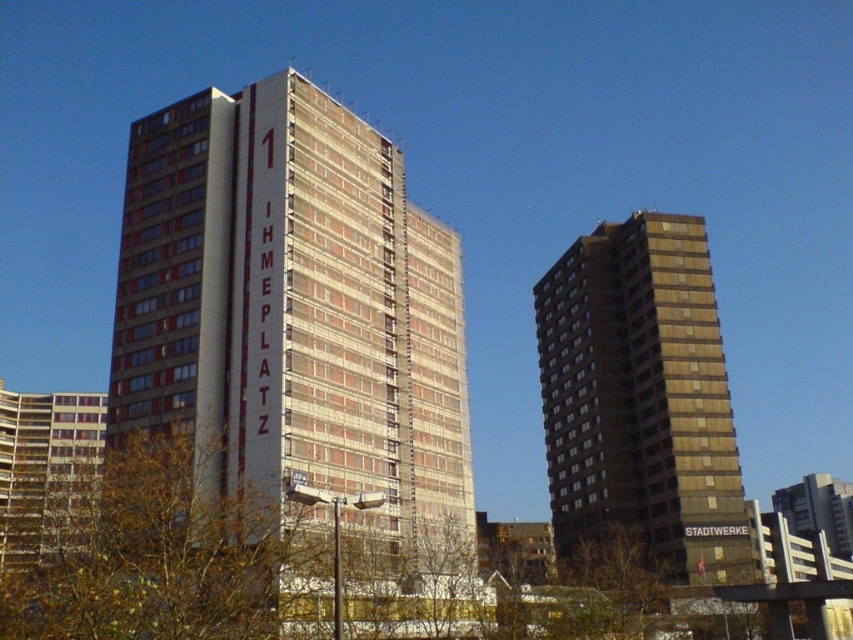
Does brick textured building at center have a larger size compared to brown matte building at right?

Indeed, brick textured building at center has a larger size compared to brown matte building at right.

Can you confirm if brick textured building at center is positioned to the left of brown matte building at right?

Correct, you'll find brick textured building at center to the left of brown matte building at right.

Between point (461, 326) and point (689, 289), which one is positioned in front?

Positioned in front is point (461, 326).

Identify the location of brick textured building at center. The image size is (853, 640). (294, 312).